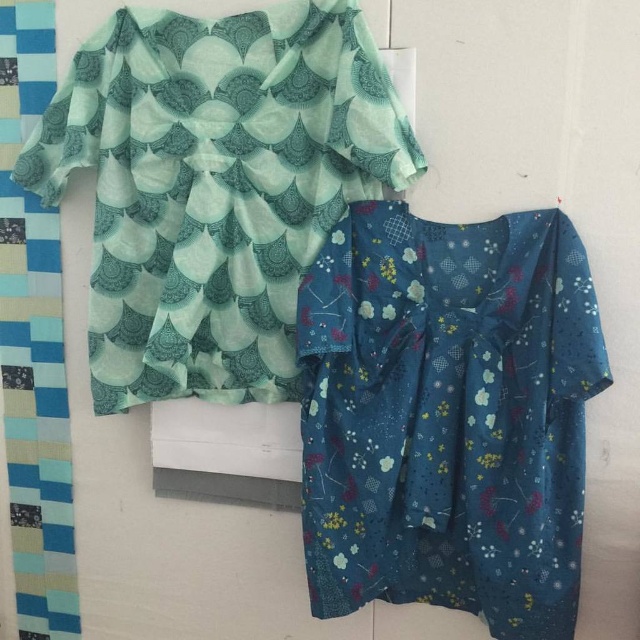
How distant is blue floral fabric dress at lower right from teal fabric dress at upper left?

They are 7.85 inches apart.

Looking at this image, does blue floral fabric dress at lower right have a greater width compared to teal fabric dress at upper left?

In fact, blue floral fabric dress at lower right might be narrower than teal fabric dress at upper left.

The height and width of the screenshot is (640, 640). Describe the element at coordinates (448, 416) in the screenshot. I see `blue floral fabric dress at lower right` at that location.

Where is `blue floral fabric dress at lower right`? The width and height of the screenshot is (640, 640). blue floral fabric dress at lower right is located at coordinates pyautogui.click(x=448, y=416).